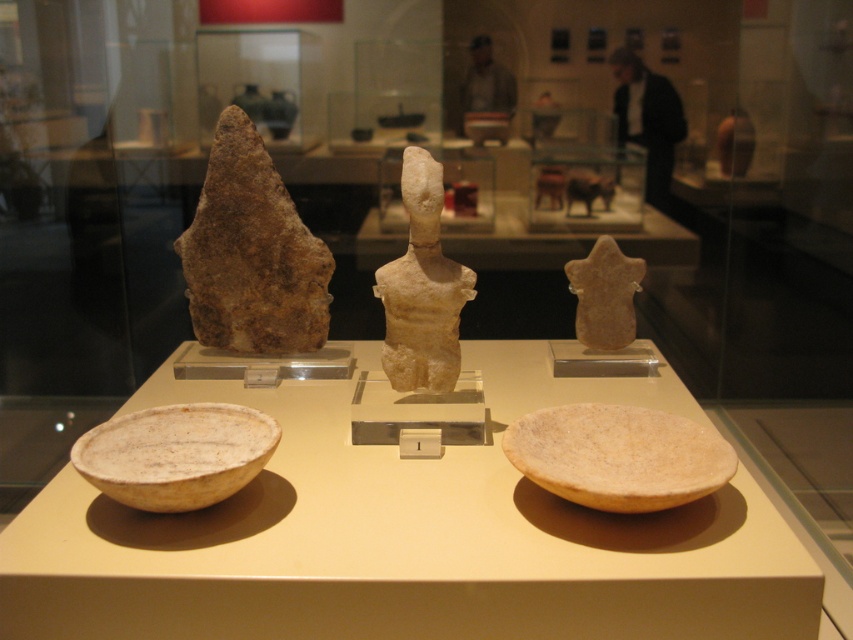
Question: Considering the real-world distances, which object is farthest from the white matte bowl at lower left?

Choices:
 (A) smooth beige stone star at center
 (B) matte beige bowl at lower center
 (C) white stone figure at center
 (D) brown stone sculpture at left

Answer: (A)

Question: Is the position of brown stone sculpture at left more distant than that of matte beige bowl at lower center?

Choices:
 (A) yes
 (B) no

Answer: (A)

Question: Which point is farther to the camera?

Choices:
 (A) click(x=144, y=420)
 (B) click(x=598, y=451)

Answer: (A)

Question: Which object is the farthest from the brown stone sculpture at left?

Choices:
 (A) white stone figure at center
 (B) matte beige bowl at lower center

Answer: (B)

Question: Does brown stone sculpture at left have a greater width compared to white matte bowl at lower left?

Choices:
 (A) no
 (B) yes

Answer: (B)

Question: Where is white stone figure at center located in relation to smooth beige stone star at center in the image?

Choices:
 (A) below
 (B) above

Answer: (B)